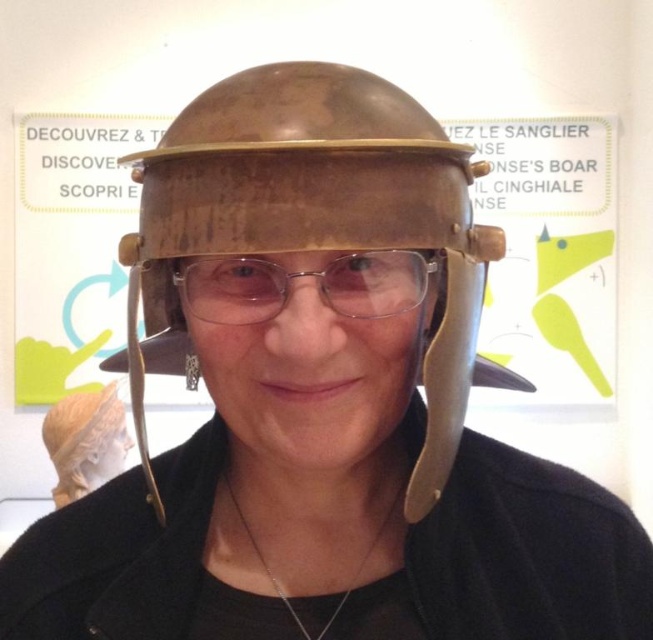
Question: Which point appears farthest from the camera in this image?

Choices:
 (A) (59, 404)
 (B) (511, 148)
 (C) (364, 280)
 (D) (304, 129)

Answer: (B)

Question: From the image, what is the correct spatial relationship of rusty metal helmet at center in relation to metallic sign at upper center?

Choices:
 (A) below
 (B) above

Answer: (A)

Question: Which point is farther to the camera?

Choices:
 (A) (165, 192)
 (B) (189, 266)

Answer: (B)

Question: Is rusty metal helmet at center closer to camera compared to silver chain at center?

Choices:
 (A) no
 (B) yes

Answer: (B)

Question: Can you confirm if rusty metal helmet at center is positioned to the right of metallic sign at upper center?

Choices:
 (A) yes
 (B) no

Answer: (B)

Question: Which of these objects is positioned closest to the metallic sign at upper center?

Choices:
 (A) silver chain at center
 (B) matte gold helmet at center
 (C) rusty metal helmet at center
 (D) metallic/transparent glasses at center

Answer: (B)